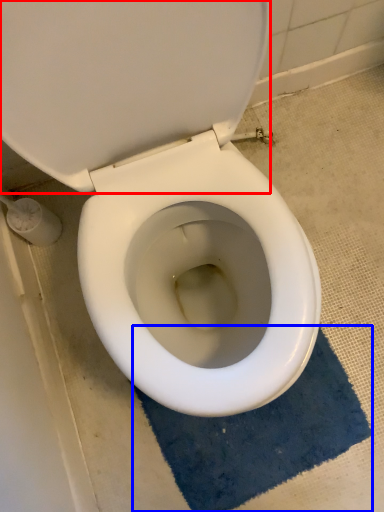
Question: Which of the following is the farthest to the observer, back (highlighted by a red box) or bath mat (highlighted by a blue box)?

Choices:
 (A) back
 (B) bath mat

Answer: (A)